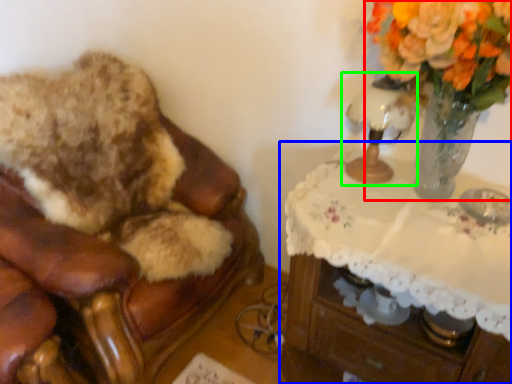
Question: Based on their relative distances, which object is nearer to floral arrangement (highlighted by a red box)? Choose from table (highlighted by a blue box) and table lamp (highlighted by a green box).

Choices:
 (A) table
 (B) table lamp

Answer: (B)